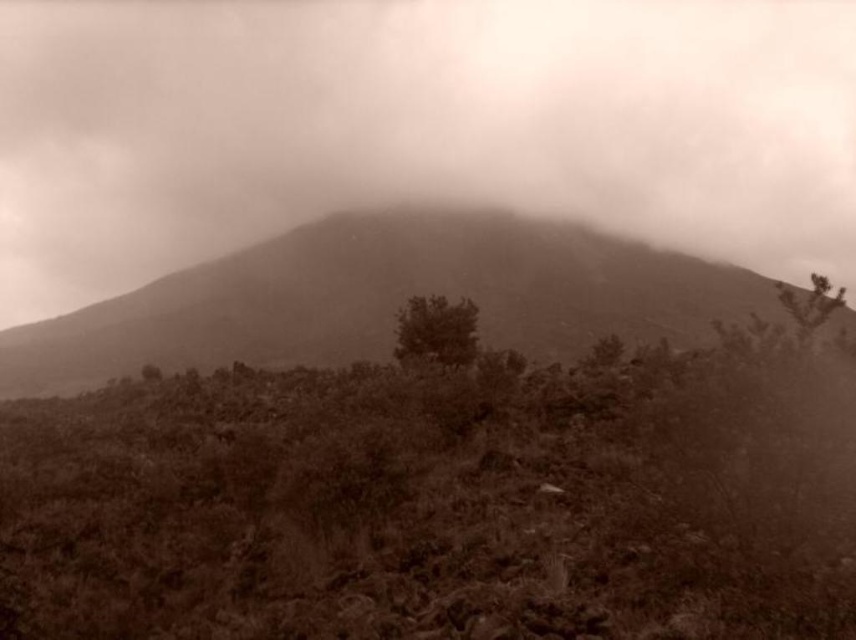
Question: Which point is farther to the camera?

Choices:
 (A) (752, 438)
 (B) (468, 326)
 (C) (92, 154)

Answer: (C)

Question: Is foggy mist at center to the left of green leafy bush at center from the viewer's perspective?

Choices:
 (A) no
 (B) yes

Answer: (A)

Question: Which of the following is the farthest from the observer?

Choices:
 (A) (325, 129)
 (B) (542, 426)

Answer: (A)

Question: Is the position of sepia textured mountain at center less distant than that of green leafy bush at center?

Choices:
 (A) no
 (B) yes

Answer: (B)

Question: Considering the real-world distances, which object is closest to the brown textured shrubbery at center?

Choices:
 (A) green leafy bush at center
 (B) sepia textured mountain at center

Answer: (A)

Question: Can you confirm if brown textured shrubbery at center is positioned above foggy mist at center?

Choices:
 (A) no
 (B) yes

Answer: (A)